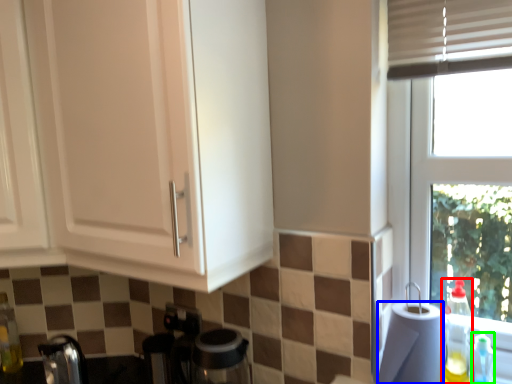
Question: Which object is the farthest from bottle (highlighted by a red box)? Choose among these: paper towel (highlighted by a blue box) or bottle (highlighted by a green box).

Choices:
 (A) paper towel
 (B) bottle

Answer: (A)